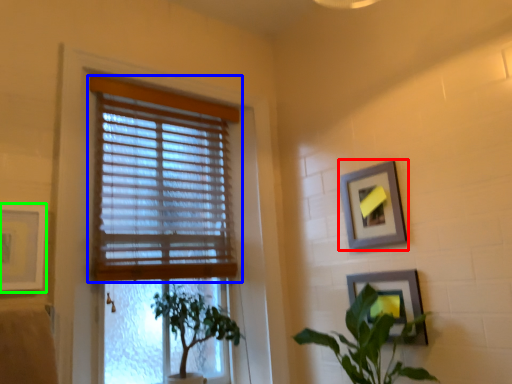
Question: Which is nearer to the picture frame (highlighted by a red box)? window blind (highlighted by a blue box) or picture frame (highlighted by a green box).

Choices:
 (A) window blind
 (B) picture frame

Answer: (A)